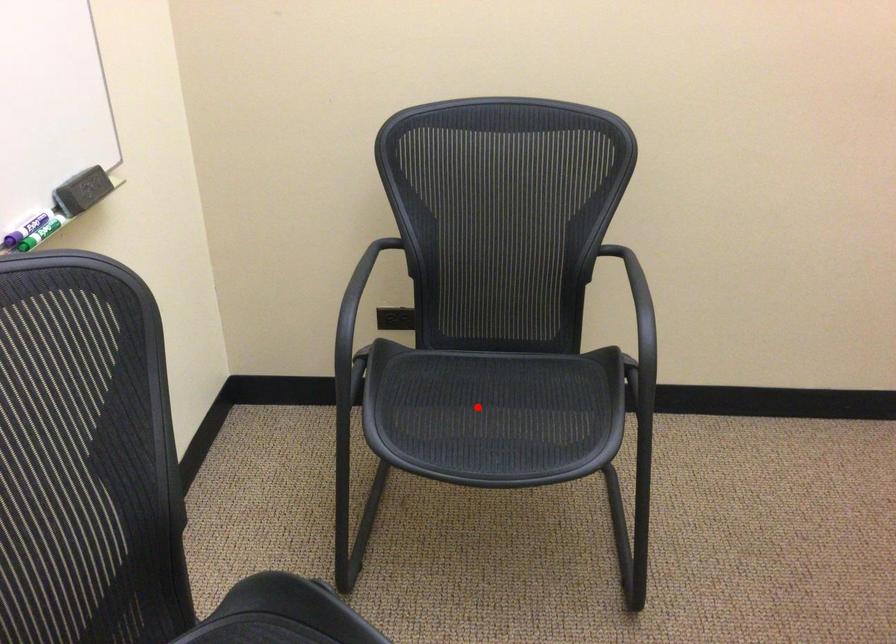
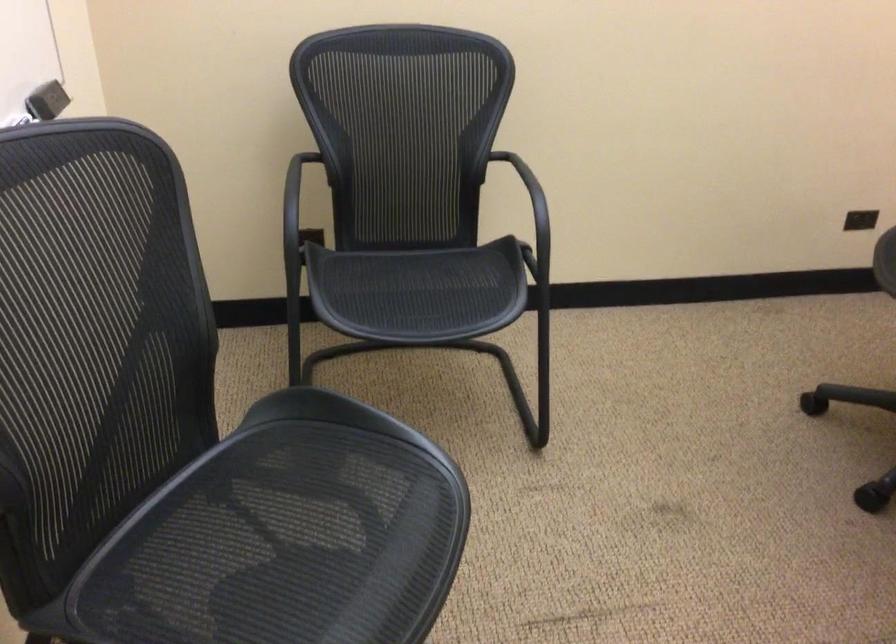
Question: I am providing you with two images of the same scene from different viewpoints. A red point is shown in image1. For the corresponding object point in image2, is it positioned nearer or farther from the camera?

Choices:
 (A) Nearer
 (B) Farther

Answer: (B)